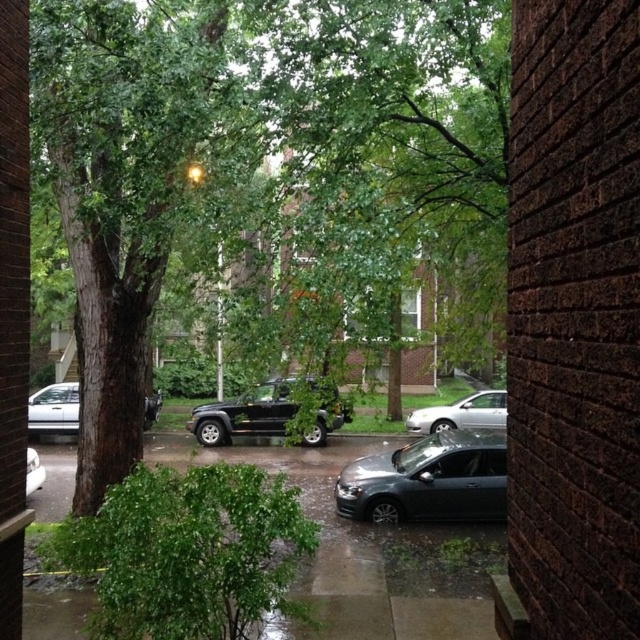
Question: Is silver metallic sedan at center to the right of white matte car at left from the viewer's perspective?

Choices:
 (A) yes
 (B) no

Answer: (A)

Question: Observing the image, what is the correct spatial positioning of green leafy tree at center in reference to satin black sedan at center?

Choices:
 (A) right
 (B) left

Answer: (B)

Question: Which is nearer to the silver metallic sedan at center?

Choices:
 (A) silver metallic sedan at left
 (B) white matte car at left

Answer: (B)

Question: Which of these objects is positioned farthest from the silver metallic sedan at left?

Choices:
 (A) green leafy tree at center
 (B) shiny black suv at center
 (C) silver metallic sedan at center

Answer: (A)

Question: Which object is positioned closest to the satin black sedan at center?

Choices:
 (A) silver metallic sedan at left
 (B) silver metallic sedan at center
 (C) white matte car at left
 (D) green leafy tree at center

Answer: (D)

Question: Does green leafy tree at center have a smaller size compared to shiny black suv at center?

Choices:
 (A) no
 (B) yes

Answer: (A)